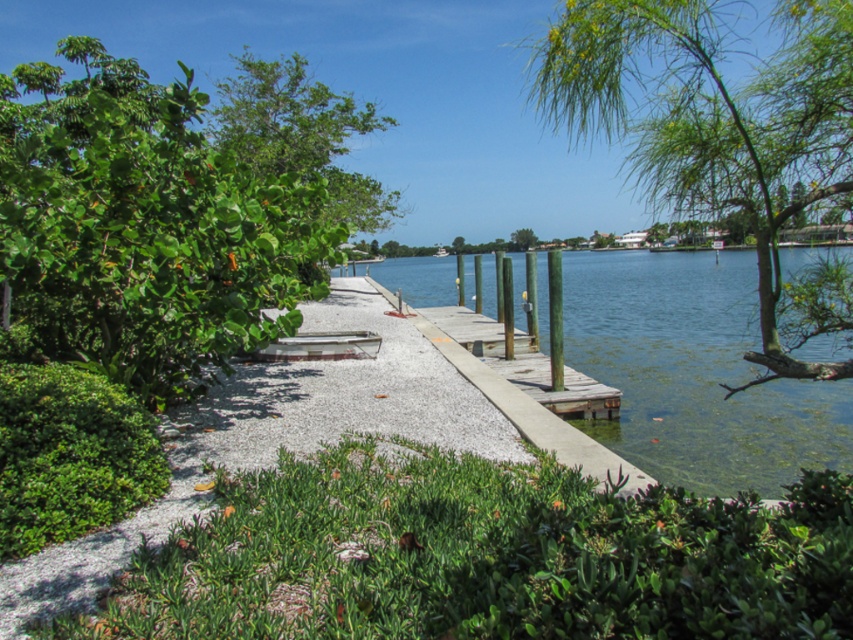
You are a photographer standing on the wooden dock. You want to capture a photo that includes both the green leafy tree at left and the clear water at dock center. Which object should you position closer to the top of your camera frame?

The green leafy tree at left should be positioned closer to the top of your camera frame because it is above the clear water at dock center in the scene.

You are a bird looking for a place to perch. You see the green leafy tree at left and the clear water at dock center. Which location is taller for perching?

The green leafy tree at left is taller than the clear water at dock center, so it is a better option for perching.

Consider the image. You are standing on the wooden dock at the right side of the image. You want to reach the clear water at dock center located at point (694, 372). What direction should you move in to get there?

You should move towards the center of the dock from the wooden dock at the right side to reach the clear water at dock center located at point (694, 372).